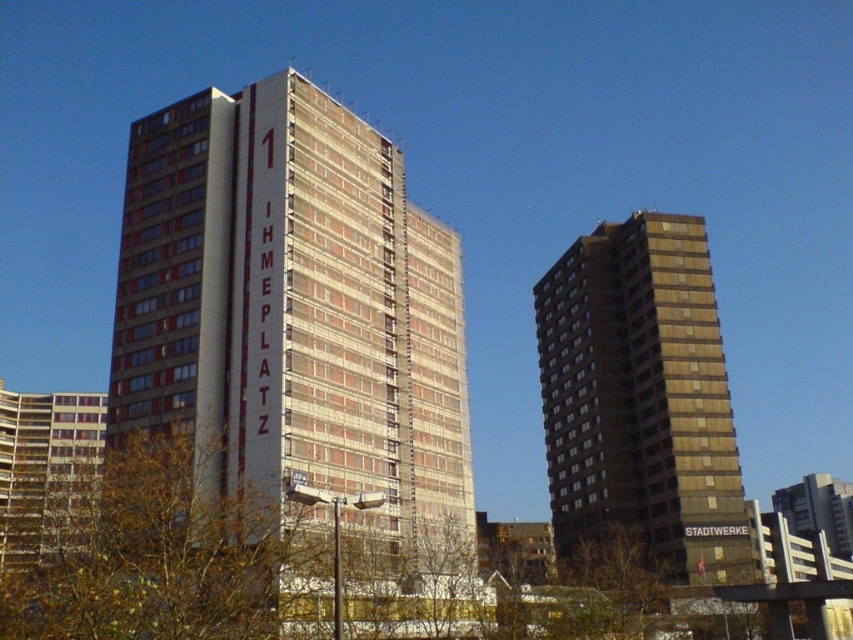
You are standing at the base of the taller building with the red stripe and need to determine the visibility of two points marked on the facade. Which point, point at coordinate (265, 102) or point at coordinate (573, 397), is closer to your current position?

Point at coordinate (265, 102) is closer to the viewer than point at coordinate (573, 397).

You are an architect planning to install solar panels on both the brick textured building at center and the brown matte building at right. Based on their sizes, which building would require more solar panels to achieve the same energy output per square meter?

The brick textured building at center is larger in size than the brown matte building at right, so it would require more solar panels to achieve the same energy output per square meter.

You are an architect evaluating the two buildings in the scene. Which building has a greater width between the brick textured building at center and the brown matte building at right?

The brick textured building at center has a greater width than the brown matte building at right.